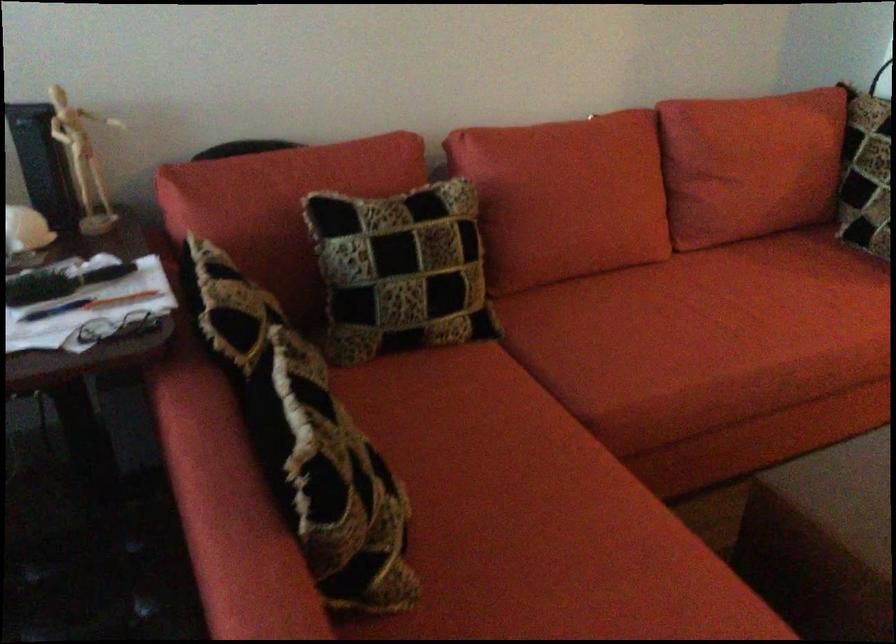
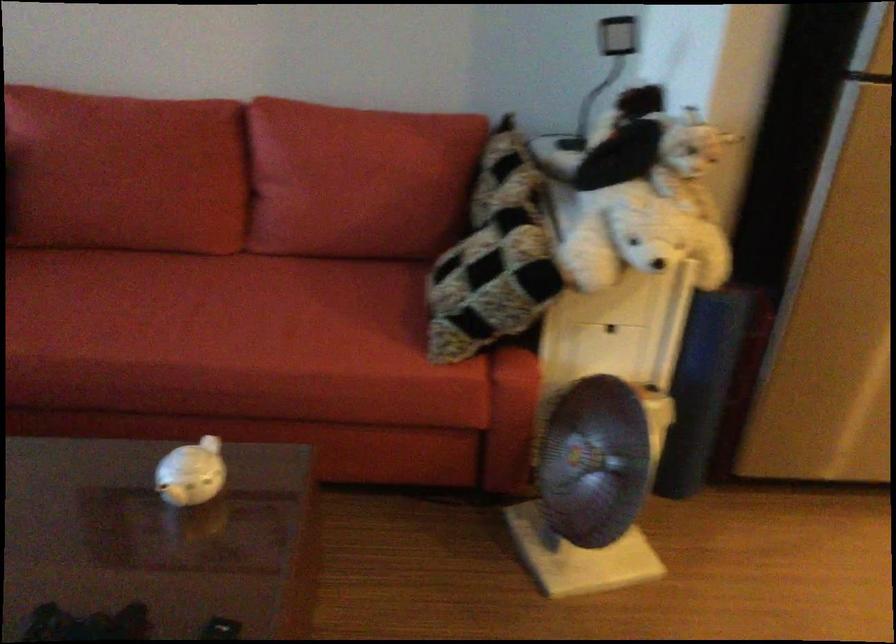
Question: Which direction would the cameraman need to move to produce the second image? Reply with the corresponding letter.

Choices:
 (A) Left
 (B) Right
 (C) Forward
 (D) Backward

Answer: (B)